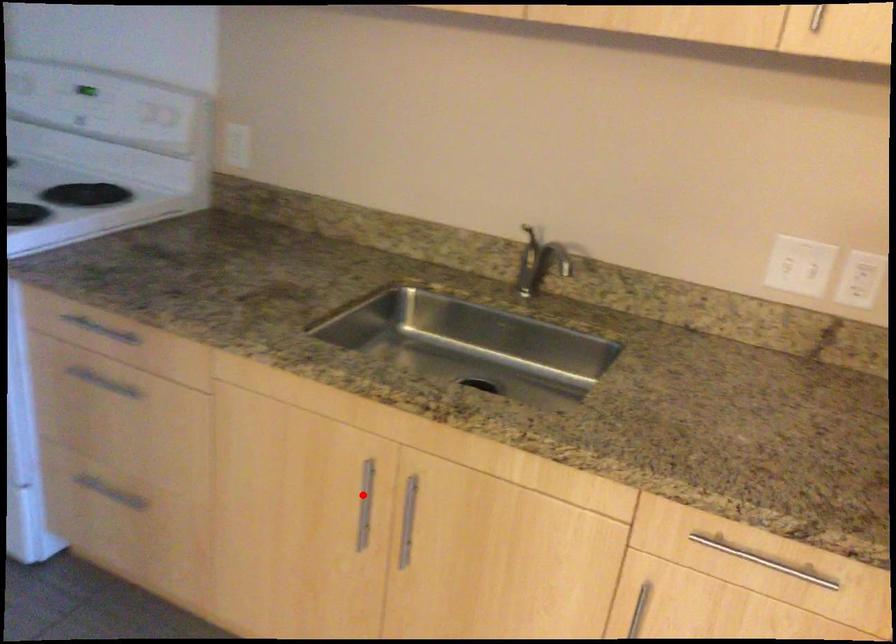
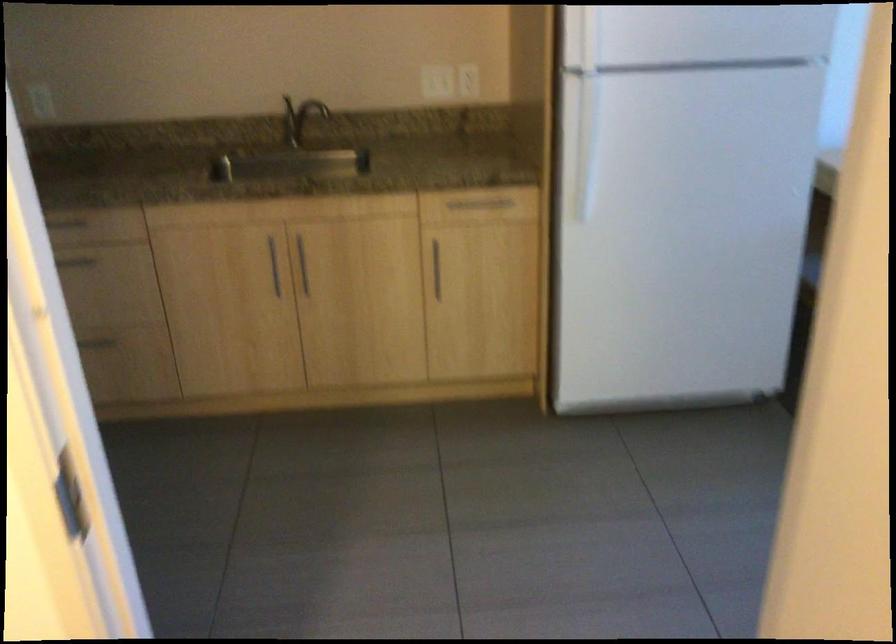
In the second image, find the point that corresponds to the highlighted location in the first image.

(273, 265)